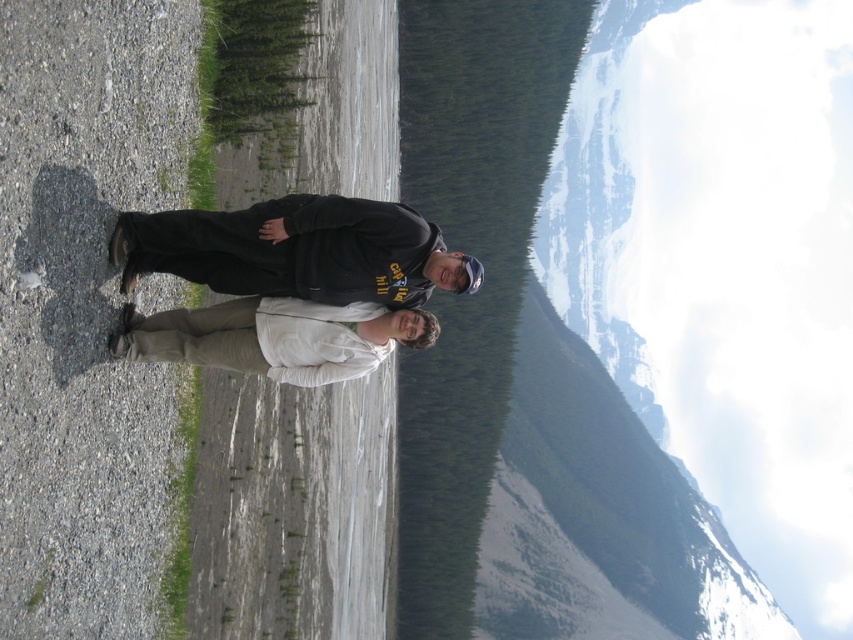
Question: Can you confirm if black matte hoodie at center is bigger than white matte jacket at center?

Choices:
 (A) yes
 (B) no

Answer: (A)

Question: Can you confirm if black matte hoodie at center is smaller than white matte jacket at center?

Choices:
 (A) yes
 (B) no

Answer: (B)

Question: Among these objects, which one is farthest from the camera?

Choices:
 (A) white matte jacket at center
 (B) black matte hoodie at center

Answer: (A)

Question: Which object is farther from the camera taking this photo?

Choices:
 (A) white matte jacket at center
 (B) black matte hoodie at center

Answer: (A)

Question: Is black matte hoodie at center closer to the viewer compared to white matte jacket at center?

Choices:
 (A) no
 (B) yes

Answer: (B)

Question: Which object is farther from the camera taking this photo?

Choices:
 (A) black matte hoodie at center
 (B) white matte jacket at center

Answer: (B)